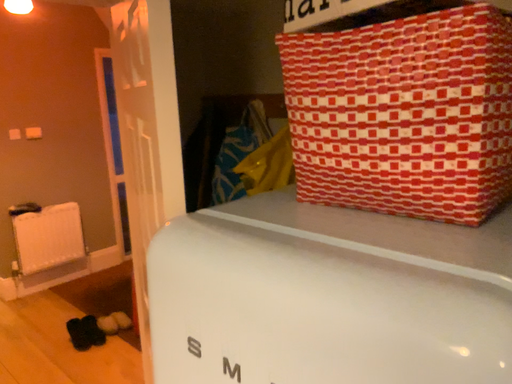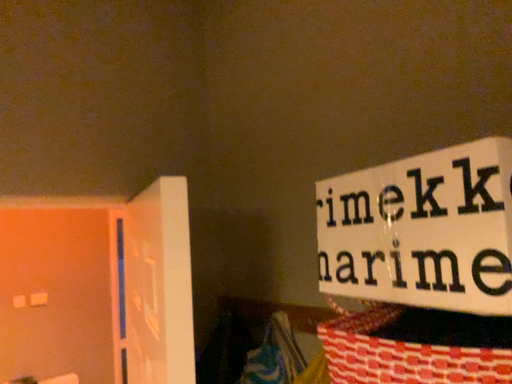
Question: How did the camera likely rotate when shooting the video?

Choices:
 (A) rotated upward
 (B) rotated downward

Answer: (A)